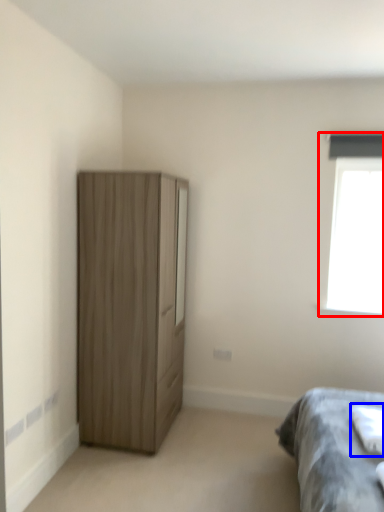
Question: Among these objects, which one is nearest to the camera, window (highlighted by a red box) or sheet (highlighted by a blue box)?

Choices:
 (A) window
 (B) sheet

Answer: (B)